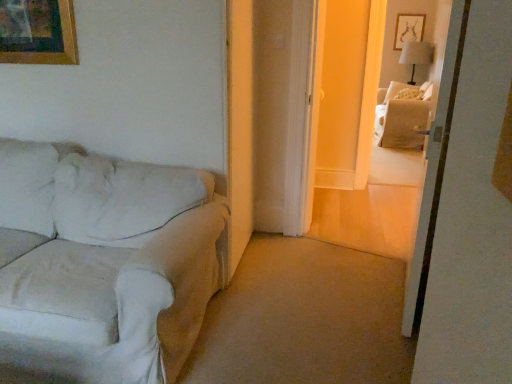
Question: Considering the relative sizes of white fabric lampshade at upper right and beige fabric couch at upper right in the image provided, is white fabric lampshade at upper right bigger than beige fabric couch at upper right?

Choices:
 (A) no
 (B) yes

Answer: (A)

Question: Can you confirm if white fabric lampshade at upper right is shorter than beige fabric couch at upper right?

Choices:
 (A) no
 (B) yes

Answer: (B)

Question: Is white fabric lampshade at upper right not near beige fabric couch at upper right?

Choices:
 (A) no
 (B) yes

Answer: (A)

Question: Are white fabric lampshade at upper right and beige fabric couch at upper right making contact?

Choices:
 (A) no
 (B) yes

Answer: (A)

Question: Is white fabric lampshade at upper right to the right of beige fabric couch at upper right from the viewer's perspective?

Choices:
 (A) no
 (B) yes

Answer: (B)

Question: Is white fabric bed at upper right bigger or smaller than white fabric couch at left?

Choices:
 (A) big
 (B) small

Answer: (B)

Question: Is white fabric bed at upper right inside the boundaries of white fabric couch at left, or outside?

Choices:
 (A) inside
 (B) outside

Answer: (B)

Question: Does point (373, 137) appear closer or farther from the camera than point (172, 362)?

Choices:
 (A) closer
 (B) farther

Answer: (B)

Question: In terms of width, does white fabric bed at upper right look wider or thinner when compared to white fabric couch at left?

Choices:
 (A) thin
 (B) wide

Answer: (A)

Question: Looking at the image, does beige fabric couch at upper right seem bigger or smaller compared to white fabric couch at left?

Choices:
 (A) small
 (B) big

Answer: (B)

Question: Would you say beige fabric couch at upper right is to the left or to the right of white fabric couch at left in the picture?

Choices:
 (A) left
 (B) right

Answer: (B)

Question: From a real-world perspective, is beige fabric couch at upper right above or below white fabric couch at left?

Choices:
 (A) below
 (B) above

Answer: (A)

Question: Considering the positions of point (410, 120) and point (163, 354), is point (410, 120) closer or farther from the camera than point (163, 354)?

Choices:
 (A) closer
 (B) farther

Answer: (B)

Question: Considering the positions of white fabric lampshade at upper right and white fabric bed at upper right in the image, is white fabric lampshade at upper right wider or thinner than white fabric bed at upper right?

Choices:
 (A) thin
 (B) wide

Answer: (B)

Question: From the image's perspective, relative to white fabric bed at upper right, is white fabric lampshade at upper right above or below?

Choices:
 (A) below
 (B) above

Answer: (B)